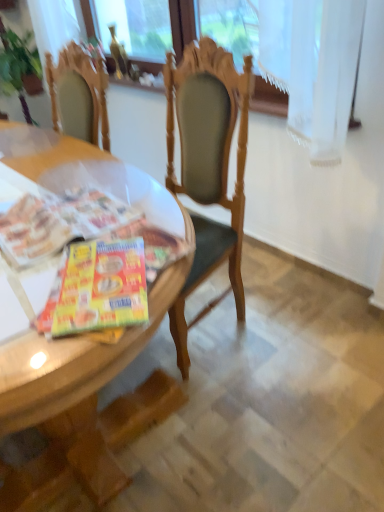
Question: From a real-world perspective, is shiny plastic magazine at table left physically located above or below gold glass bottle at upper center?

Choices:
 (A) below
 (B) above

Answer: (A)

Question: Considering their positions, is shiny plastic magazine at table left located in front of or behind gold glass bottle at upper center?

Choices:
 (A) behind
 (B) front

Answer: (B)

Question: Considering the real-world distances, which object is farthest from the wooden desk at center?

Choices:
 (A) shiny plastic magazine at table left
 (B) gold glass bottle at upper center

Answer: (B)

Question: Considering the real-world distances, which object is closest to the gold glass bottle at upper center?

Choices:
 (A) shiny plastic magazine at table left
 (B) wooden desk at center

Answer: (B)